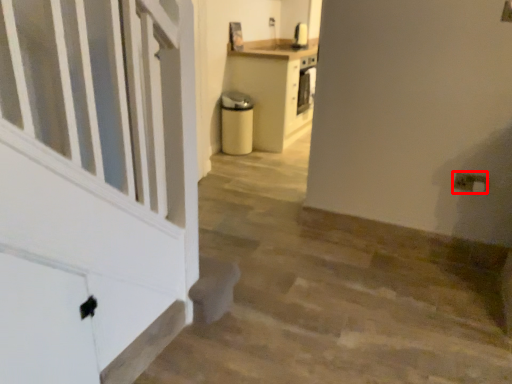
Question: In this image, where is electric outlet (annotated by the red box) located relative to stairwell?

Choices:
 (A) right
 (B) left

Answer: (A)